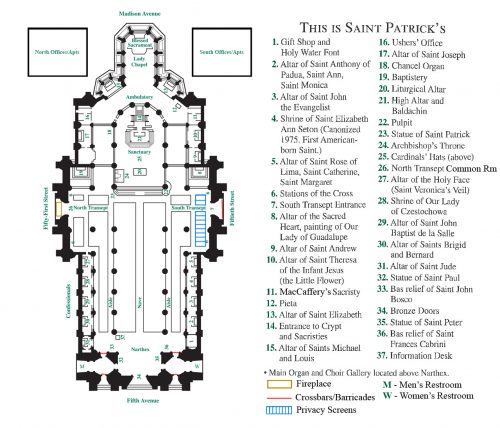
You are a GUI agent. You are given a task and a screenshot of the screen. Output one action in this format:
    pyautogui.click(x=<x>, y=<y>)
    Task: Click on the entrances
    The height and width of the screenshot is (428, 500).
    Given the screenshot: What is the action you would take?
    pyautogui.click(x=200, y=169)